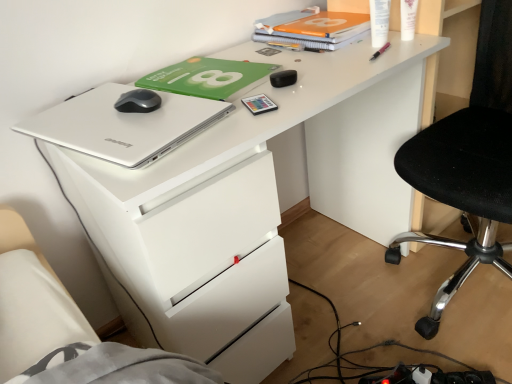
Locate an element on the screen. vacant area on top of silver metallic laptop at upper left (from a real-world perspective) is located at coordinates (112, 114).